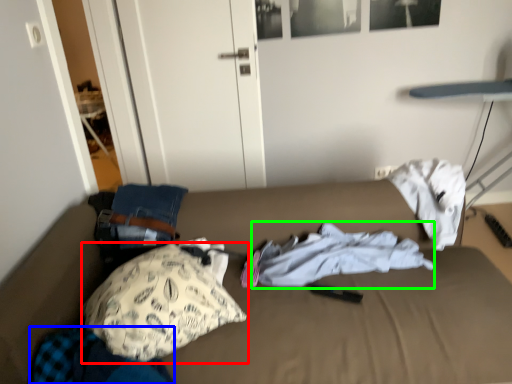
Question: Considering the real-world distances, which object is farthest from pillow (highlighted by a red box)? clothing (highlighted by a blue box) or clothing (highlighted by a green box)?

Choices:
 (A) clothing
 (B) clothing

Answer: (B)